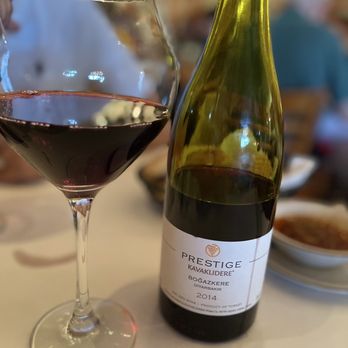
Identify the location of shadows on table. (153, 302), (38, 211).